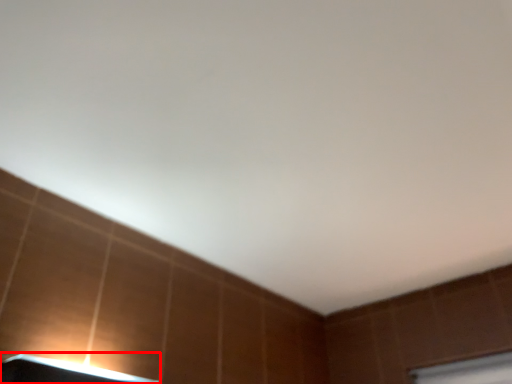
Question: From the image's perspective, where is lamp (annotated by the red box) located in relation to window frame in the image?

Choices:
 (A) above
 (B) below

Answer: (A)